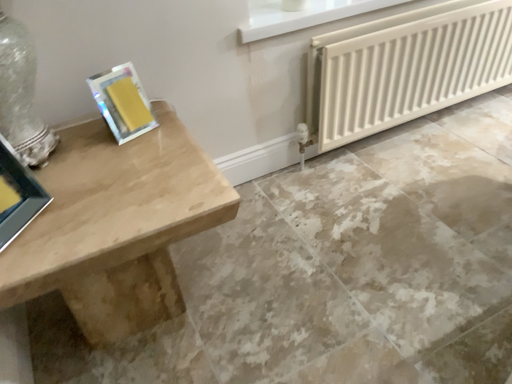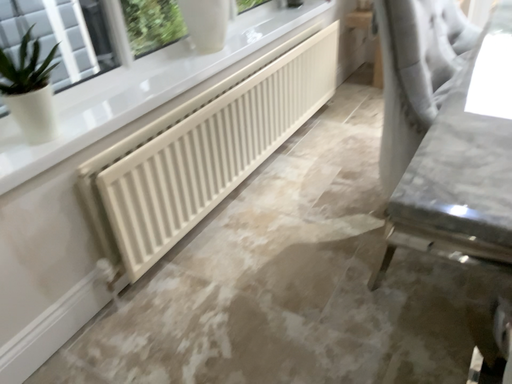
Question: Which way did the camera rotate in the video?

Choices:
 (A) rotated upward
 (B) rotated downward

Answer: (A)